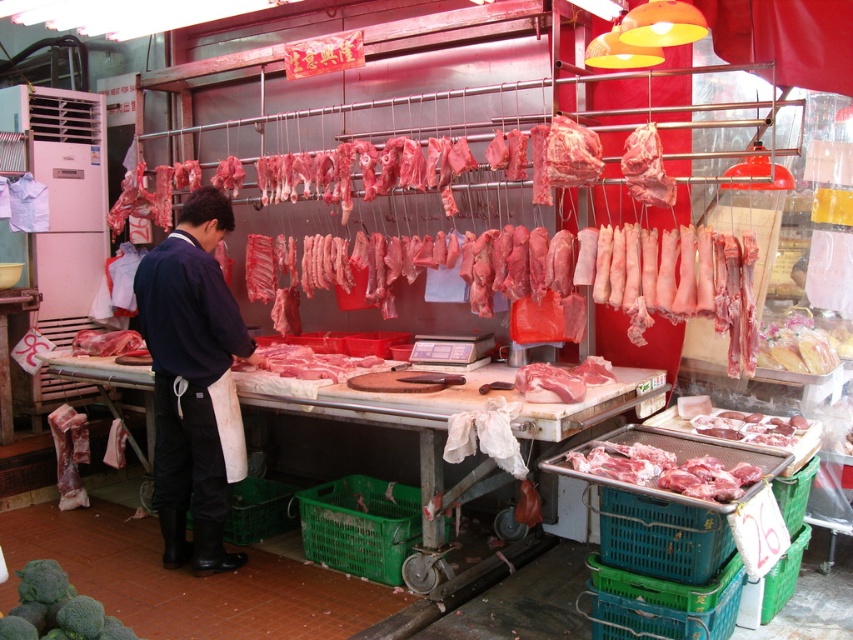
Question: Is pinkish raw meat at center smaller than pink glossy meat at center?

Choices:
 (A) no
 (B) yes

Answer: (B)

Question: Does dark blue fabric jacket at center have a smaller size compared to pinkish raw meat at center?

Choices:
 (A) yes
 (B) no

Answer: (B)

Question: Which object is farther from the camera taking this photo?

Choices:
 (A) pink glossy meat at center
 (B) pinkish raw meat at center

Answer: (A)

Question: Does pinkish raw meat at center have a lesser width compared to matte pink meat at lower right?

Choices:
 (A) yes
 (B) no

Answer: (B)

Question: Which object is positioned closest to the pinkish raw meat at center?

Choices:
 (A) pink glossy meat at center
 (B) matte pink meat at lower right

Answer: (B)

Question: Which of these objects is positioned closest to the dark blue fabric jacket at center?

Choices:
 (A) matte pink meat at lower right
 (B) green matte broccoli at lower left
 (C) pink glossy meat at center
 (D) pinkish raw meat at center

Answer: (B)